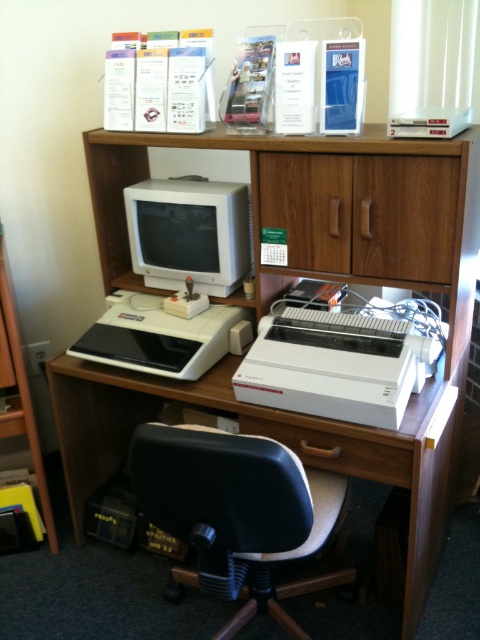
Does wooden cabinet at center have a greater width compared to white plastic printer at center?

Incorrect, wooden cabinet at center's width does not surpass white plastic printer at center's.

Which of these two, wooden cabinet at center or white plastic printer at center, stands shorter?

white plastic printer at center is shorter.

Is point (291, 186) closer to viewer compared to point (392, 406)?

No, it is behind (392, 406).

This screenshot has height=640, width=480. What are the coordinates of `wooden cabinet at center` in the screenshot? It's located at pos(363,212).

Can you confirm if wooden computer desk at center is smaller than black plastic printer at center?

Incorrect, wooden computer desk at center is not smaller in size than black plastic printer at center.

Measure the distance between wooden computer desk at center and camera.

wooden computer desk at center and camera are 1.40 meters apart from each other.

Locate an element on the screen. The height and width of the screenshot is (640, 480). wooden computer desk at center is located at coordinates (288, 288).

Can you confirm if white plastic printer at center is positioned above black plastic printer at center?

No, white plastic printer at center is not above black plastic printer at center.

Is white plastic printer at center to the right of black plastic printer at center from the viewer's perspective?

Indeed, white plastic printer at center is positioned on the right side of black plastic printer at center.

The height and width of the screenshot is (640, 480). In order to click on white plastic printer at center in this screenshot , I will do `click(336, 365)`.